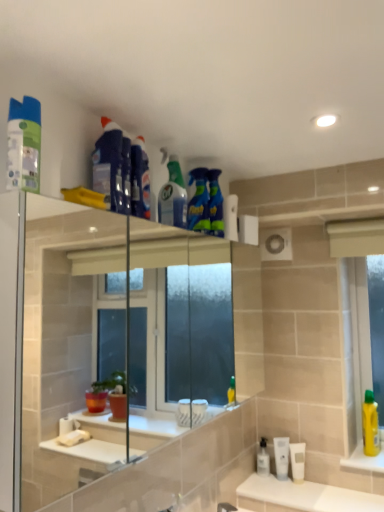
Question: Looking at the image, does clear plastic faucet at lower center seem bigger or smaller compared to white glossy sink at lower center?

Choices:
 (A) big
 (B) small

Answer: (B)

Question: Is clear plastic faucet at lower center in front of or behind white glossy sink at lower center in the image?

Choices:
 (A) behind
 (B) front

Answer: (B)

Question: Based on their relative distances, which object is nearer to the transparent plastic mouthwash at lower center, which is the third mouthwash from right to left?

Choices:
 (A) clear plastic faucet at lower center
 (B) white matte tube at lower right, marked as the 2th mouthwash in a left-to-right arrangement
 (C) white glossy sink at lower center
 (D) translucent green spray bottle at upper center, the fourth cleaning product in the front-to-back sequence
 (E) matte plastic spray can at upper left, the sixth cleaning product when ordered from right to left

Answer: (B)

Question: Estimate the real-world distances between objects in this image. Which object is farther from the white matte tube at lower right, which is counted as the second mouthwash, starting from the right?

Choices:
 (A) white glossy sink at lower center
 (B) blue glossy spray bottle at upper center, which ranks as the 1th cleaning product in back-to-front order
 (C) clear plastic faucet at lower center
 (D) translucent green spray bottle at upper center, which is counted as the fourth cleaning product, starting from the left
 (E) transparent plastic mouthwash at lower center, which is the third mouthwash from right to left

Answer: (D)